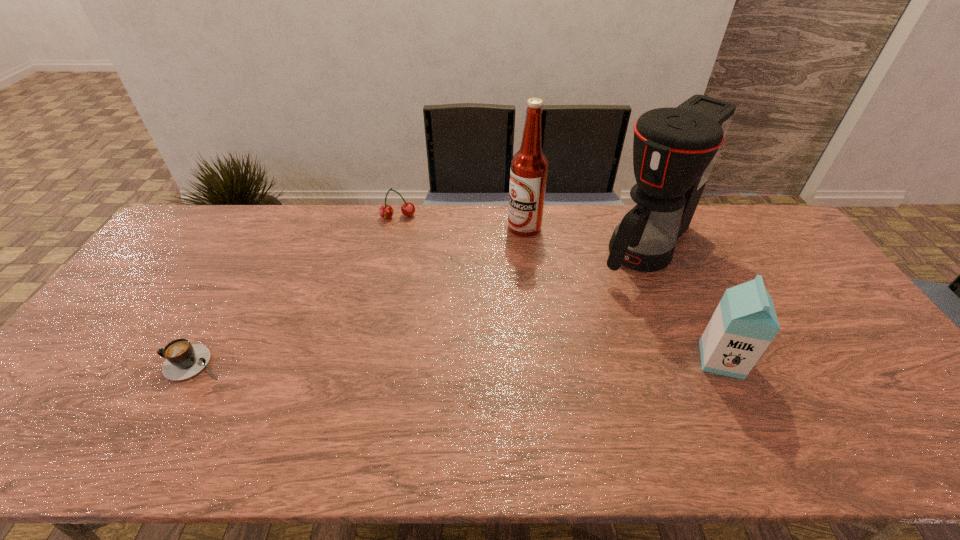
You are a GUI agent. You are given a task and a screenshot of the screen. Output one action in this format:
    pyautogui.click(x=<x>, y=<y>)
    Task: Click on the vacant space on the desktop that is between the leftmost object and the third tallest object and is positioned with stems pointing upwards on the fourth tallest object
    
    Given the screenshot: What is the action you would take?
    pyautogui.click(x=401, y=362)

At what (x,y) coordinates should I click in order to perform the action: click on vacant space on the desktop that is between the shortest object and the milk carton and is positioned on the label side of the alcohol. Please return your answer as a coordinate pair (x, y). Looking at the image, I should click on (381, 362).

Find the location of `vacant space on the desktop that is between the shortest object and the milk carton and is positioned pour from the carafe of the coffee maker`. vacant space on the desktop that is between the shortest object and the milk carton and is positioned pour from the carafe of the coffee maker is located at coordinates (529, 361).